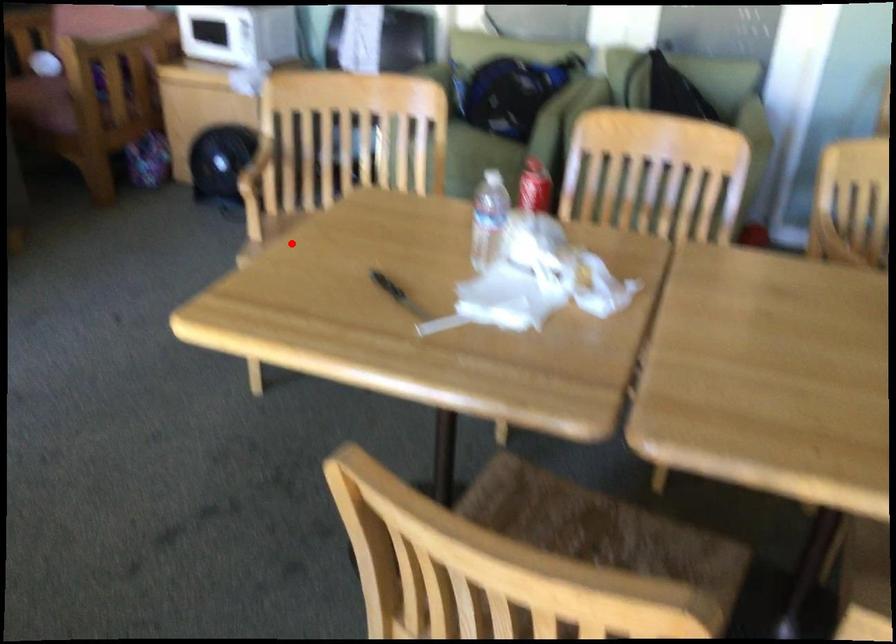
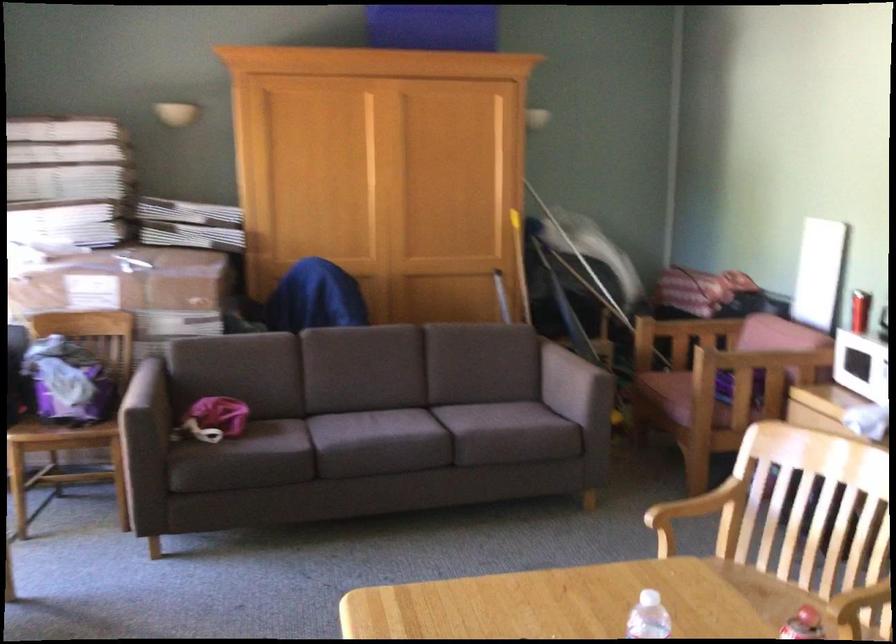
Question: I am providing you with two images of the same scene from different viewpoints. Image1 has a red point marked. In image2, the corresponding 3D location appears at what relative position? Reply with the corresponding letter.

Choices:
 (A) Closer
 (B) Farther

Answer: (A)